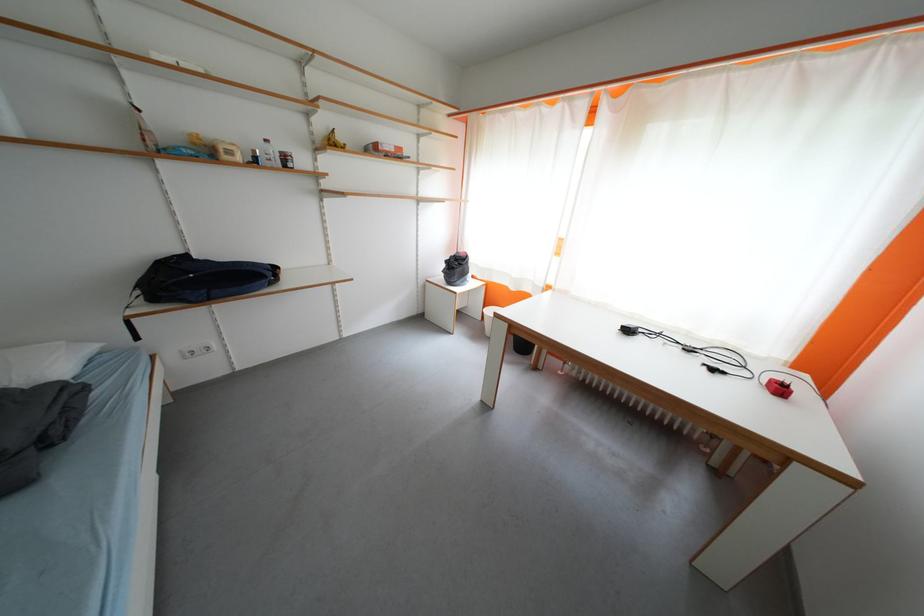
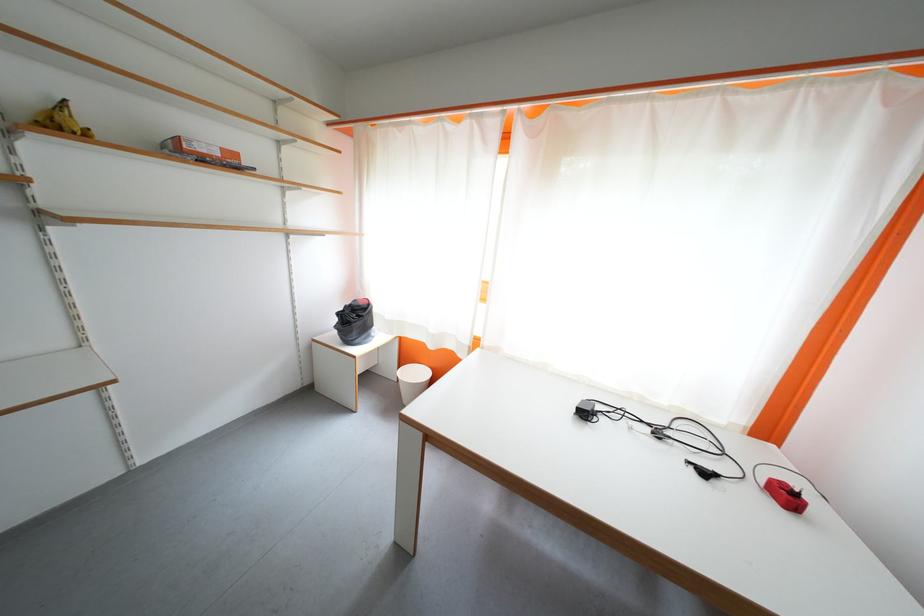
The point at (339, 147) is marked in the first image. Where is the corresponding point in the second image?

(68, 129)